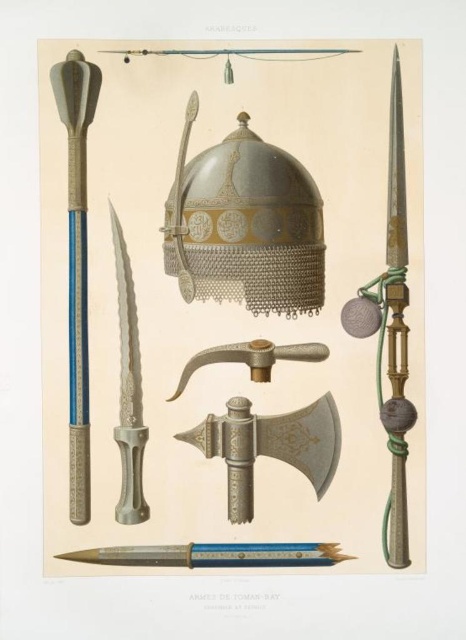
Consider the image. Is brushed metal sword at left thinner than silver metallic dagger at center-left?

No.

Is point (69, 241) positioned after point (123, 333)?

No, it is in front of (123, 333).

I want to click on brushed metal sword at left, so click(76, 262).

Can you confirm if metallic chainmail helmet at center is wider than brushed metal sword at left?

Correct, the width of metallic chainmail helmet at center exceeds that of brushed metal sword at left.

Can you confirm if metallic chainmail helmet at center is shorter than brushed metal sword at left?

Yes.

The width and height of the screenshot is (466, 640). Identify the location of metallic chainmail helmet at center. (245, 225).

Is metallic chainmail helmet at center smaller than silver metallic dagger at center-left?

No, metallic chainmail helmet at center is not smaller than silver metallic dagger at center-left.

Which is above, metallic chainmail helmet at center or silver metallic dagger at center-left?

metallic chainmail helmet at center

This screenshot has height=640, width=466. What do you see at coordinates (245, 225) in the screenshot? I see `metallic chainmail helmet at center` at bounding box center [245, 225].

Image resolution: width=466 pixels, height=640 pixels. In order to click on metallic chainmail helmet at center in this screenshot , I will do `click(245, 225)`.